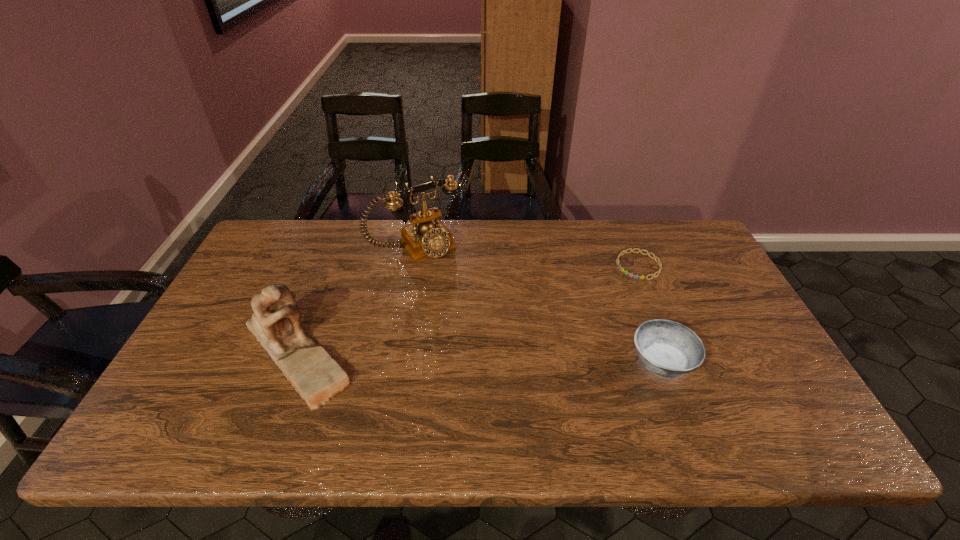
Where is `free location located 0.300m on the dial number of the telephone`? Image resolution: width=960 pixels, height=540 pixels. free location located 0.300m on the dial number of the telephone is located at coordinates (485, 322).

Identify the location of bracelet that is at the far edge. (631, 275).

Identify the location of telephone positioned at the far edge. (427, 237).

In order to click on figurine that is at the near edge in this screenshot , I will do `click(276, 324)`.

Identify the location of ashtray positioned at the near edge. (668, 349).

In order to click on object at the left edge in this screenshot , I will do `click(276, 324)`.

Locate an element on the screen. object that is at the near left corner is located at coordinates (276, 324).

Identify the location of free space at the far edge. The width and height of the screenshot is (960, 540). (468, 252).

In the image, there is a desktop. Identify the location of vacant space at the near edge. (324, 406).

The height and width of the screenshot is (540, 960). What are the coordinates of `unoccupied area between the ashtray and the figurine` in the screenshot? It's located at (479, 356).